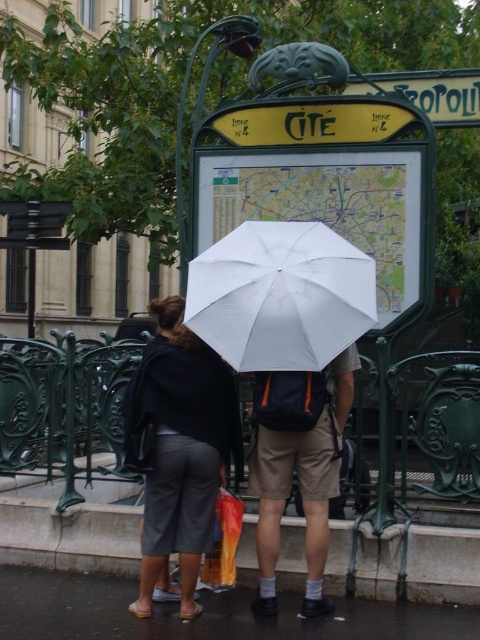
Can you confirm if dark gray fabric pants at lower left is positioned above white matte umbrella at center?

No, dark gray fabric pants at lower left is not above white matte umbrella at center.

Can you confirm if dark gray fabric pants at lower left is positioned below white matte umbrella at center?

Indeed, dark gray fabric pants at lower left is positioned under white matte umbrella at center.

At what (x,y) coordinates should I click in order to perform the action: click on dark gray fabric pants at lower left. Please return your answer as a coordinate pair (x, y). The height and width of the screenshot is (640, 480). Looking at the image, I should click on (179, 451).

The height and width of the screenshot is (640, 480). What are the coordinates of `dark gray fabric pants at lower left` in the screenshot? It's located at (179, 451).

Between dark gray fabric pants at lower left and dark gray asphalt at lower center, which one appears on the left side from the viewer's perspective?

dark gray fabric pants at lower left

What do you see at coordinates (179, 451) in the screenshot? I see `dark gray fabric pants at lower left` at bounding box center [179, 451].

I want to click on dark gray fabric pants at lower left, so click(x=179, y=451).

Does white matte umbrella at center come behind khaki cotton shorts at center?

No, white matte umbrella at center is in front of khaki cotton shorts at center.

Does point (323, 358) lie in front of point (283, 413)?

Yes, it is in front of point (283, 413).

Locate an element on the screen. This screenshot has width=480, height=640. white matte umbrella at center is located at coordinates [280, 296].